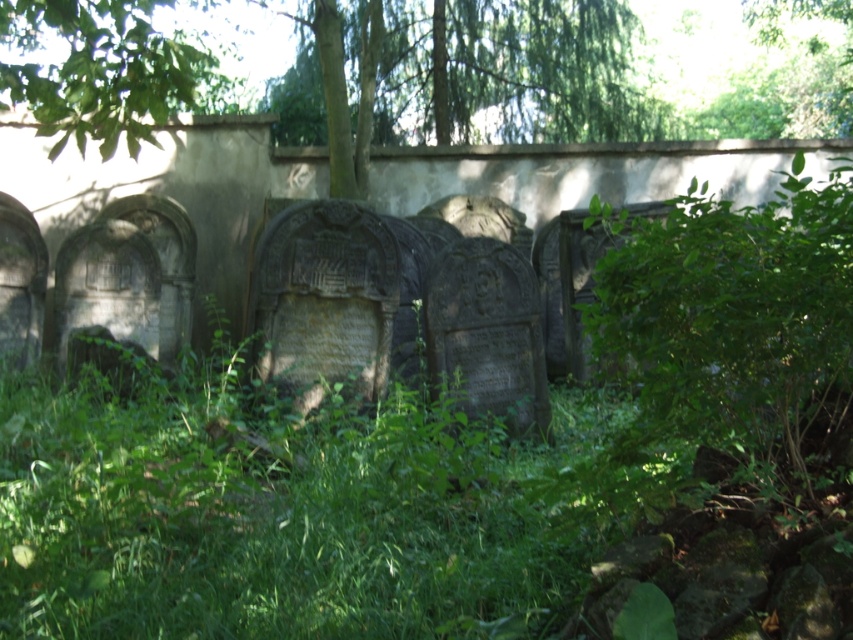
Is point (80, 19) positioned after point (817, 3)?

No, it is in front of (817, 3).

Which is more to the right, green leafy tree at upper left or green leafy tree at upper right?

From the viewer's perspective, green leafy tree at upper right appears more on the right side.

Is point (192, 54) farther from viewer compared to point (755, 16)?

No.

Image resolution: width=853 pixels, height=640 pixels. What are the coordinates of `green leafy tree at upper left` in the screenshot? It's located at (103, 70).

Is green leafy tree at upper center smaller than green leafy tree at upper left?

No, green leafy tree at upper center is not smaller than green leafy tree at upper left.

Is green leafy tree at upper center bigger than green leafy tree at upper left?

Correct, green leafy tree at upper center is larger in size than green leafy tree at upper left.

Where is `green leafy tree at upper center`? This screenshot has width=853, height=640. green leafy tree at upper center is located at coordinates (x=471, y=74).

Where is `green leafy tree at upper center`? green leafy tree at upper center is located at coordinates (471, 74).

At what (x,y) coordinates should I click in order to perform the action: click on green leafy tree at upper center. Please return your answer as a coordinate pair (x, y). This screenshot has width=853, height=640. Looking at the image, I should click on (471, 74).